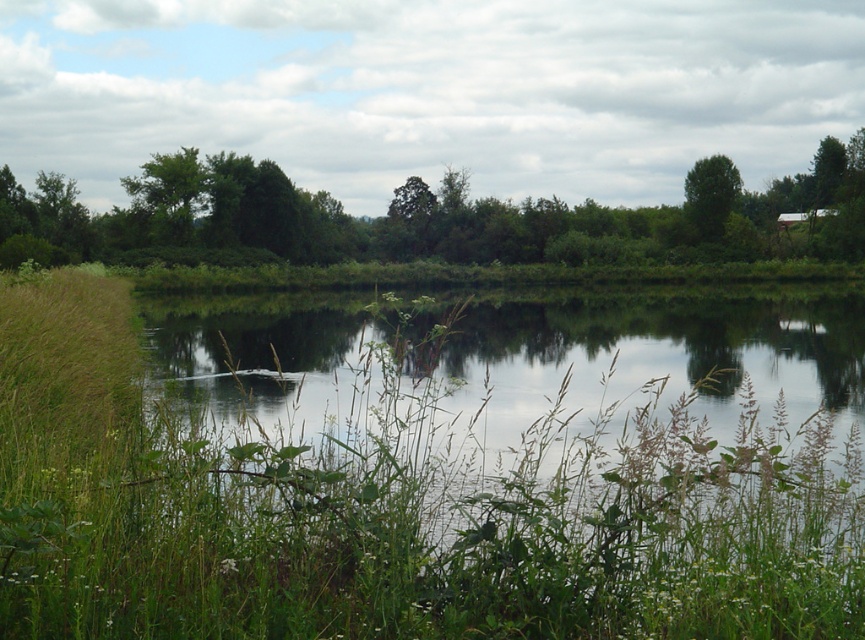
In the scene shown: You are a photographer wanting to capture the reflection of the green leafy tree at center in the transparent water at center. Based on the scene, will the reflection be clearly visible?

The transparent water at center is in front of green leafy tree at center, so the reflection of the green leafy tree at center would be clearly visible in the transparent water at center since the water is calm and reflective as described in the scene.

You are standing at the edge of the pond and see the transparent water at center and the green leafy tree at upper left. Which object is closer to your right side?

The transparent water at center is closer to your right side because it is positioned to the right of the green leafy tree at upper left.

You are a bird looking for a nesting spot. You see two trees in the scene, the green leafy tree at center and the green leafy tree at upper left. Which tree is taller and would provide a better vantage point?

The green leafy tree at center is taller than the green leafy tree at upper left, so it would provide a better vantage point for nesting.